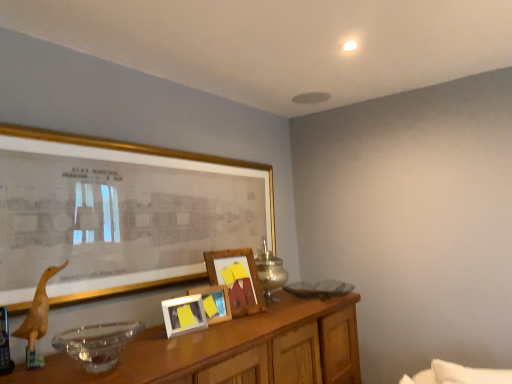
Locate an element on the screen. This screenshot has height=384, width=512. free spot below transparent glass bowl at center (from a real-world perspective) is located at coordinates (97, 356).